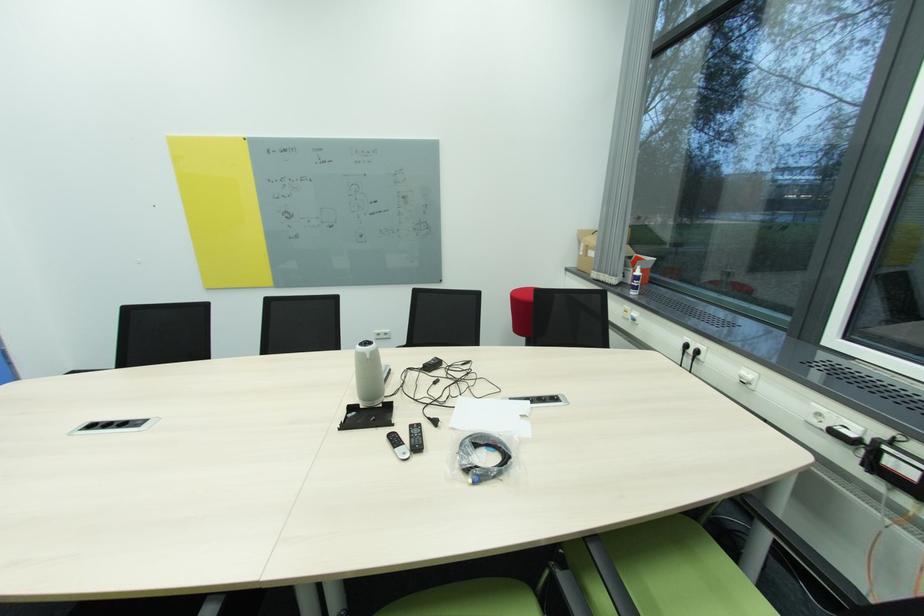
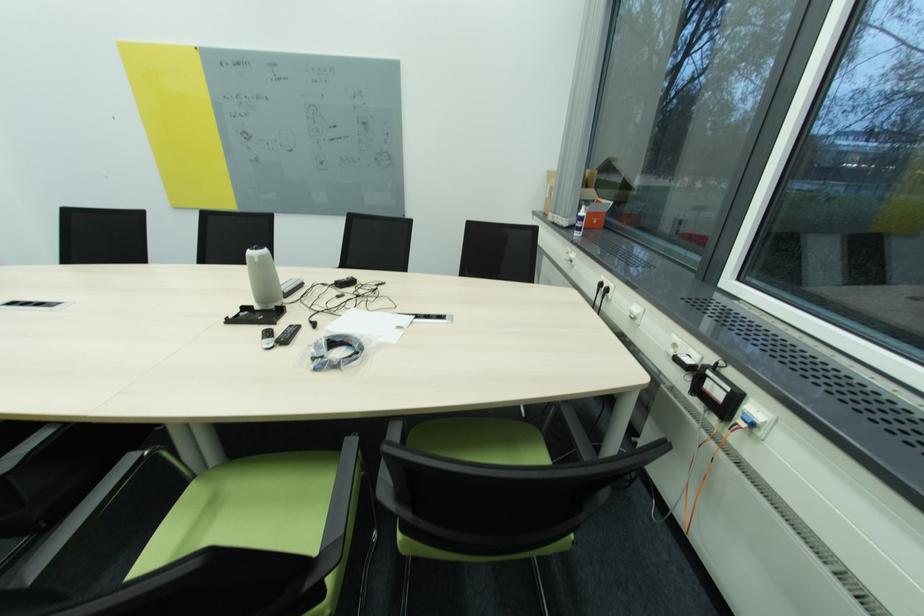
In the second image, find the point that corresponds to the point at 690,347 in the first image.

(604, 286)